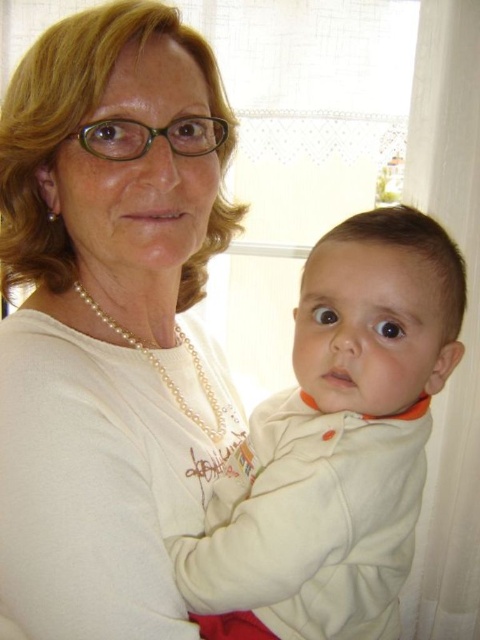
You are a photographer setting up a shoot. You have a client wearing a pearl necklace at upper center and holding a white fleece baby at center. You want to ensure the baby is positioned to the right of the necklace. Does the current arrangement meet your requirement?

Yes, the current arrangement meets the requirement because the white fleece baby at center is positioned to the right of the pearl necklace at upper center as specified.

You are a photographer taking a portrait of the woman and baby. You notice two pearl necklaces in the scene. Which pearl necklace, the pearl necklace at center or the pearl necklace at upper center, should the woman adjust to ensure it doesn?t overpower the baby in the photo?

The pearl necklace at center is larger in size than the pearl necklace at upper center. To avoid overpowering the baby, the woman should adjust the pearl necklace at center.